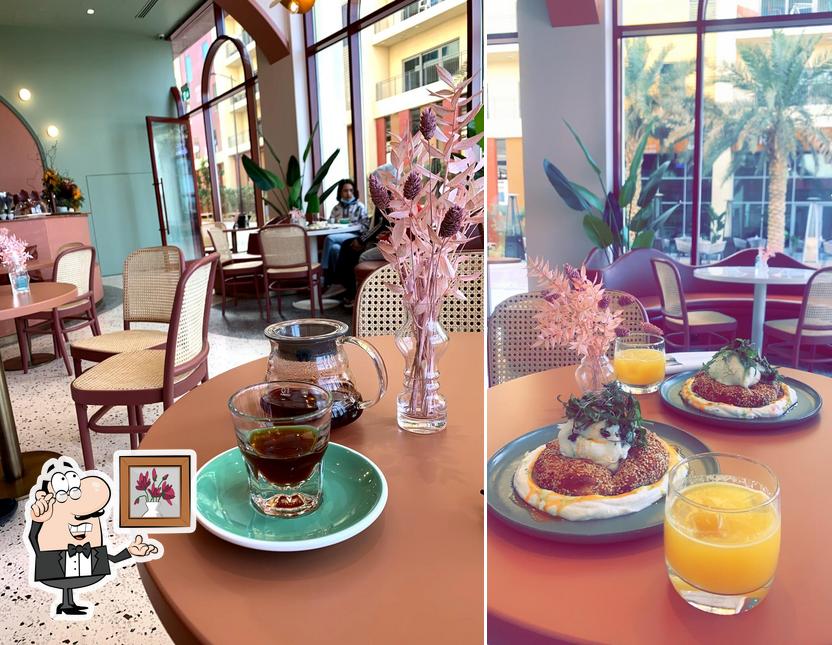
Find the location of a particular element. ceramic is located at coordinates (339, 493), (630, 528), (801, 401).